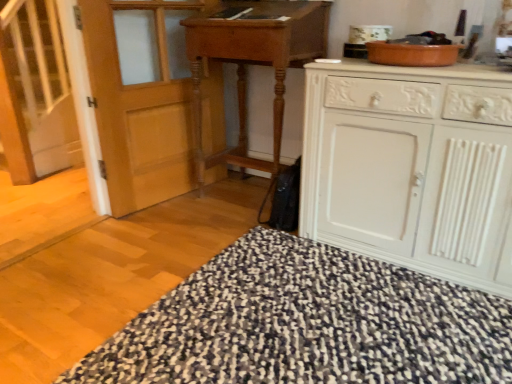
Image resolution: width=512 pixels, height=384 pixels. Find the location of `free region under wooden table at center (from a real-world perspective)`. free region under wooden table at center (from a real-world perspective) is located at coordinates (242, 197).